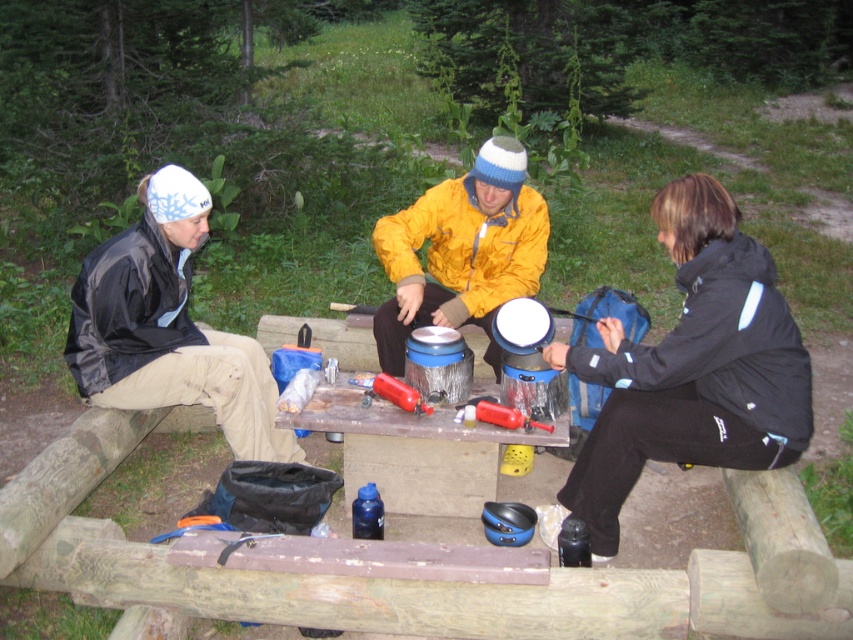
Is black matte jacket at left smaller than yellow matte jacket at center?

No.

Which is below, black matte jacket at left or yellow matte jacket at center?

black matte jacket at left is lower down.

Is point (160, 404) positioned behind point (444, 260)?

No, (160, 404) is closer to viewer.

You are a GUI agent. You are given a task and a screenshot of the screen. Output one action in this format:
    pyautogui.click(x=<x>, y=<y>)
    Task: Click on the black matte jacket at left
    The width and height of the screenshot is (853, 640).
    Given the screenshot: What is the action you would take?
    pyautogui.click(x=167, y=326)

Is matte black jacket at left thinner than black matte jacket at left?

In fact, matte black jacket at left might be wider than black matte jacket at left.

Can you confirm if matte black jacket at left is shorter than black matte jacket at left?

No, matte black jacket at left is not shorter than black matte jacket at left.

This screenshot has width=853, height=640. What do you see at coordinates (689, 369) in the screenshot? I see `matte black jacket at left` at bounding box center [689, 369].

The image size is (853, 640). In order to click on matte black jacket at left in this screenshot , I will do tap(689, 369).

Between matte black jacket at left and yellow matte jacket at center, which one appears on the left side from the viewer's perspective?

Positioned to the left is yellow matte jacket at center.

Who is higher up, matte black jacket at left or yellow matte jacket at center?

yellow matte jacket at center

This screenshot has height=640, width=853. Identify the location of matte black jacket at left. (689, 369).